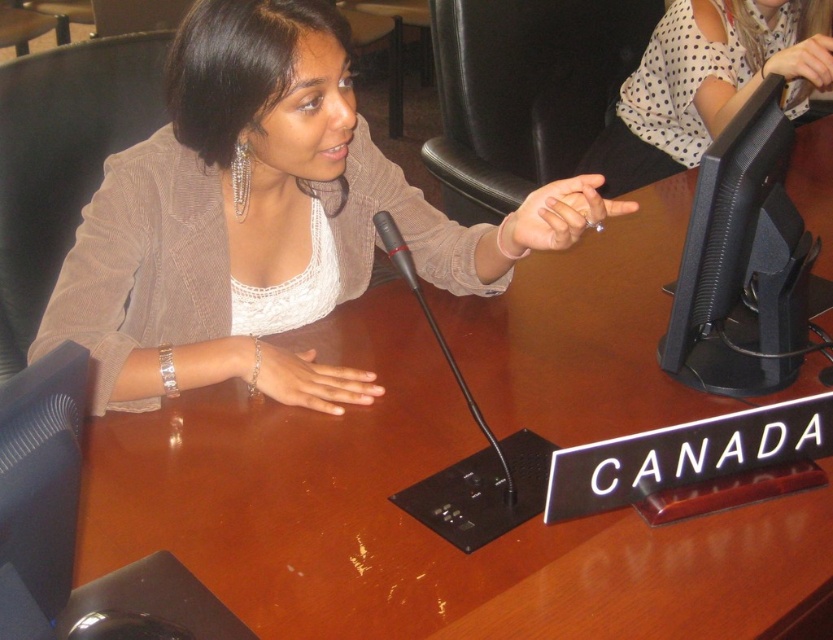
You are a photographer setting up for a panel discussion. You need to ensure the matte beige sweater at upper left and the black plastic microphone at center are both visible in your shot. Which object should you position closer to the left edge of the frame to include both?

The matte beige sweater at upper left should be positioned closer to the left edge of the frame since it is already on the left side of the black plastic microphone at center, allowing both to be captured in the shot.

You are a sound technician setting up for a panel discussion. You have a black plastic microphone at center and a matte black hand at upper right in your view. Which object is narrower?

The black plastic microphone at center is thinner than the matte black hand at upper right, so the black plastic microphone at center is narrower.

You are a photographer standing at a distance from the matte beige sweater at upper left. You want to capture a closeup shot of it without moving closer. Can you do it with a standard camera lens that has a 200mm focal length?

The matte beige sweater at upper left is 36.70 inches away from the viewer. With a 200mm lens, you can achieve a closeup shot from that distance without needing to move closer.